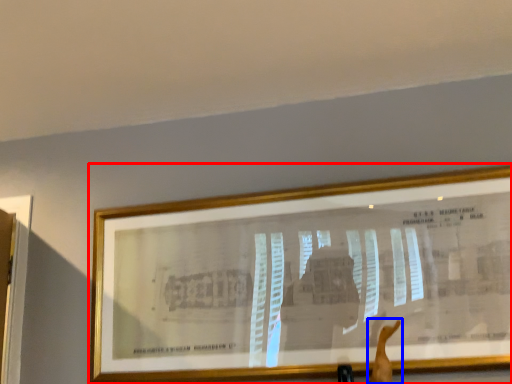
Question: Which point is closer to the camera, picture frame (highlighted by a red box) or arm (highlighted by a blue box)?

Choices:
 (A) picture frame
 (B) arm

Answer: (B)